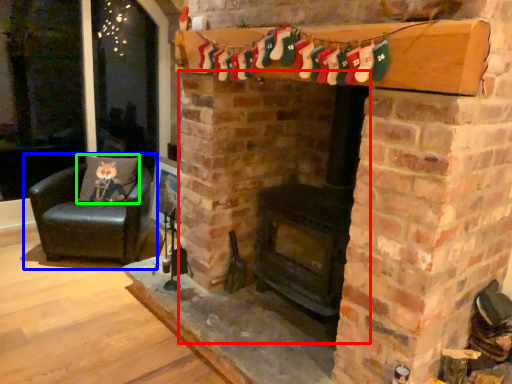
Question: Which is farther away from fireplace (highlighted by a red box)? chair (highlighted by a blue box) or pillow (highlighted by a green box)?

Choices:
 (A) chair
 (B) pillow

Answer: (B)